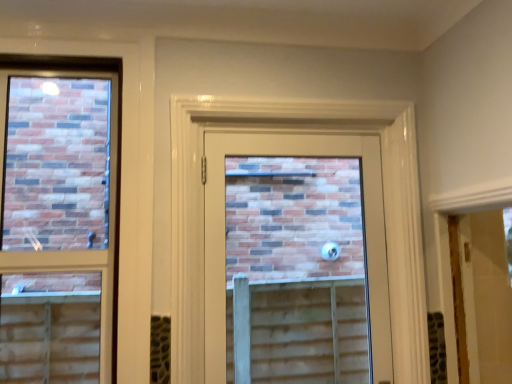
Question: Is matte glass door at center to the left or to the right of matte glass window at left in the image?

Choices:
 (A) left
 (B) right

Answer: (B)

Question: From their relative heights in the image, would you say matte glass door at center is taller or shorter than matte glass window at left?

Choices:
 (A) short
 (B) tall

Answer: (A)

Question: From the image's perspective, is matte glass door at center located above or below matte glass window at left?

Choices:
 (A) above
 (B) below

Answer: (B)

Question: Considering the positions of matte glass window at left and matte glass door at center in the image, is matte glass window at left taller or shorter than matte glass door at center?

Choices:
 (A) short
 (B) tall

Answer: (B)

Question: Is point (16, 344) closer or farther from the camera than point (223, 180)?

Choices:
 (A) farther
 (B) closer

Answer: (A)

Question: From the image's perspective, is matte glass window at left located above or below matte glass door at center?

Choices:
 (A) above
 (B) below

Answer: (A)

Question: Would you say matte glass window at left is to the left or to the right of matte glass door at center in the picture?

Choices:
 (A) right
 (B) left

Answer: (B)